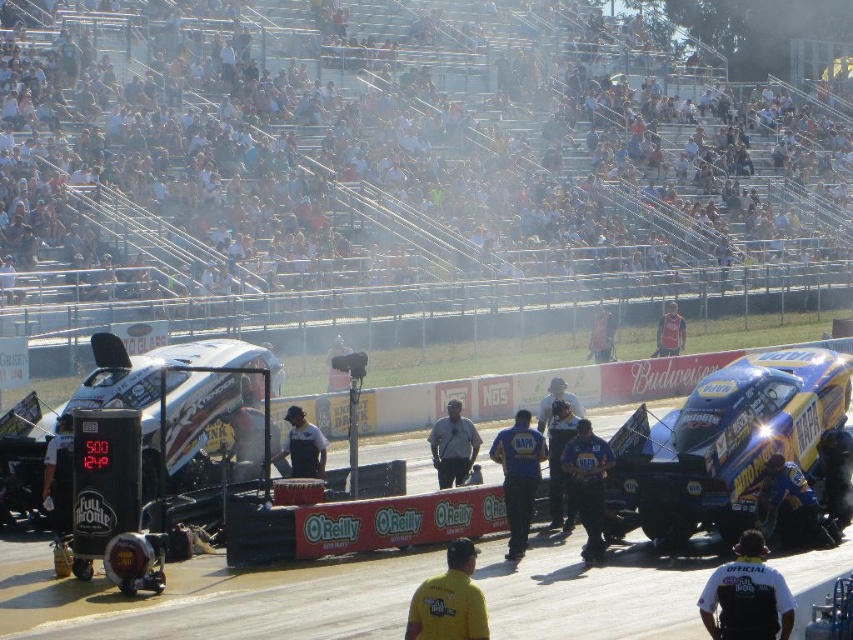
You are a photographer at a drag racing event. You need to capture a photo of the blue glossy race car at center and the silver metallic car at center. Which car should you focus on first if you want to include both in your frame without moving the camera?

The blue glossy race car at center is positioned under the silver metallic car at center, so you should focus on the silver metallic car at center first to ensure both are in the frame without moving the camera.

You are a photographer at the drag racing event. You want to capture a photo where both the blue glossy race car at center and the silver metallic car at center are visible. Given their sizes, which car should you position closer to the camera to ensure both fit in the frame?

The blue glossy race car at center is smaller than the silver metallic car at center. To ensure both fit in the frame, position the silver metallic car at center closer to the camera so that its size in the photo matches the blue glossy race car at center.

You are a photographer at the drag racing event. You want to capture a photo where both the silver metallic car at center and the orange mesh vest at center are visible. Based on their sizes, which object should you focus on to ensure both are in frame?

Since the silver metallic car at center occupies less space than the orange mesh vest at center, you should focus on the orange mesh vest at center to ensure both are visible in the photo.